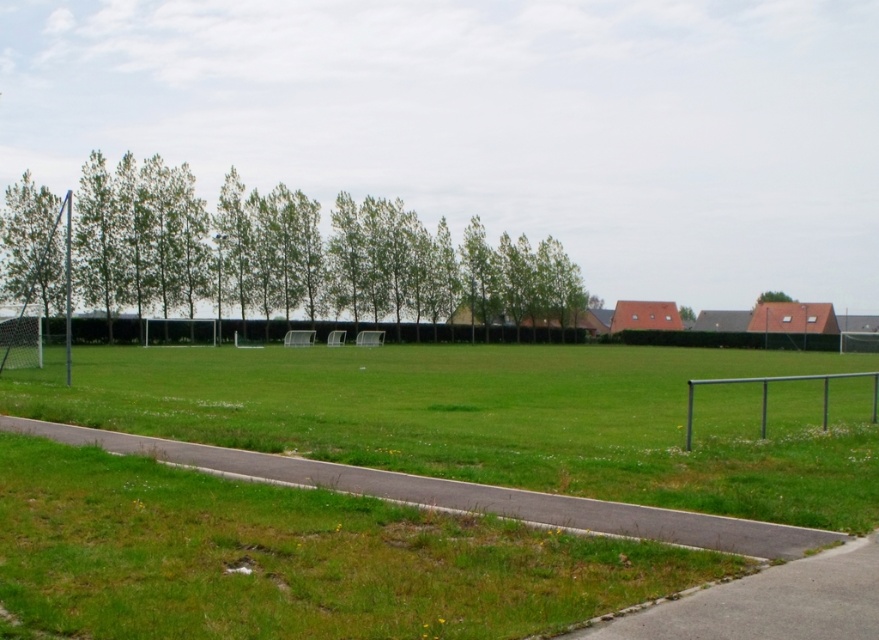
Is gray asphalt pavement at lower right above green metallic fence at lower right?

Indeed, gray asphalt pavement at lower right is positioned over green metallic fence at lower right.

Where is `gray asphalt pavement at lower right`? gray asphalt pavement at lower right is located at coordinates (768, 604).

Is point (674, 604) behind point (766, 385)?

No, (674, 604) is closer to viewer.

The image size is (879, 640). In order to click on gray asphalt pavement at lower right in this screenshot , I will do `click(768, 604)`.

Does green metallic fence at lower right have a greater width compared to green leafy tree at upper right?

No, green metallic fence at lower right is not wider than green leafy tree at upper right.

Is green metallic fence at lower right below green leafy tree at upper right?

Yes, green metallic fence at lower right is below green leafy tree at upper right.

Who is more forward, [834,372] or [769,292]?

Result: Point [834,372] is in front.

This screenshot has width=879, height=640. Find the location of `green metallic fence at lower right`. green metallic fence at lower right is located at coordinates (767, 392).

Which of these two, gravel path at lower center or gray asphalt pavement at lower right, stands taller?

With more height is gravel path at lower center.

Which is behind, point (179, 449) or point (794, 560)?

The point (179, 449) is behind.

Between point (732, 518) and point (753, 612), which one is positioned in front?

Point (753, 612) is more forward.

Find the location of a particular element. The width and height of the screenshot is (879, 640). gravel path at lower center is located at coordinates (458, 493).